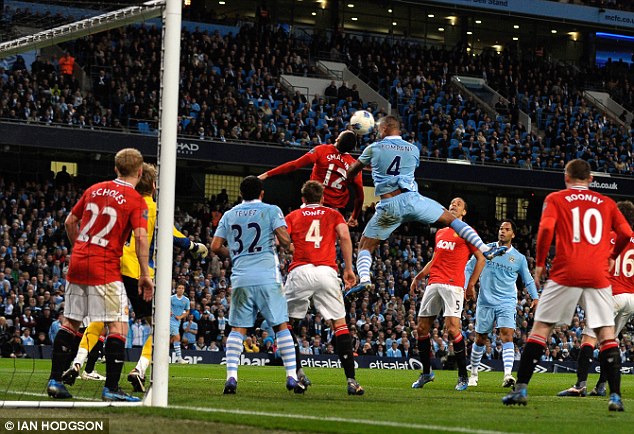
You are a GUI agent. You are given a task and a screenshot of the screen. Output one action in this format:
    pyautogui.click(x=<x>, y=<y>)
    Task: Click on the screen
    This screenshot has height=434, width=634.
    Given the screenshot: What is the action you would take?
    pyautogui.click(x=610, y=46)